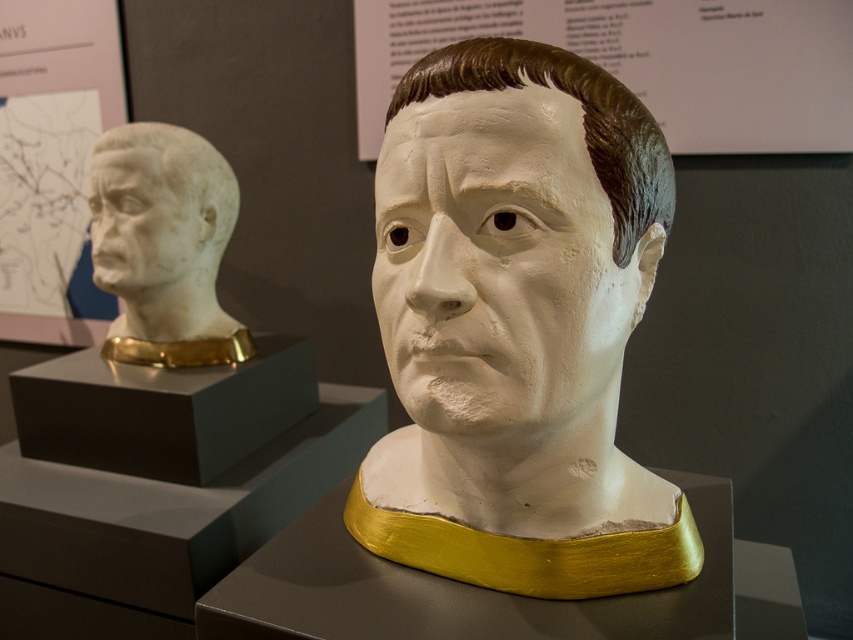
From the picture: You are an art student trying to decide which plaster cast to sketch first. The white matte plaster head at center and the white plaster face at upper left are both in view. Based on their positions and sizes, which one do you think is closer to you?

The white matte plaster head at center is closer to you because it is positioned at the center of the image, which typically indicates a closer proximity in such compositions compared to the white plaster face at upper left located further back.

You are an art student observing two busts in a museum. You notice the white marble bust at left and the white plaster face at upper left. Which of these two objects is positioned higher in the image?

The white plaster face at upper left is positioned higher in the image than the white marble bust at left.

You are an art student standing in front of two busts in a museum. You want to sketch the one that is closer to you. Which one should you choose between the white marble bust at left and the white plaster face at upper left?

The white marble bust at left is closer to you since it is further to the viewer than the white plaster face at upper left.